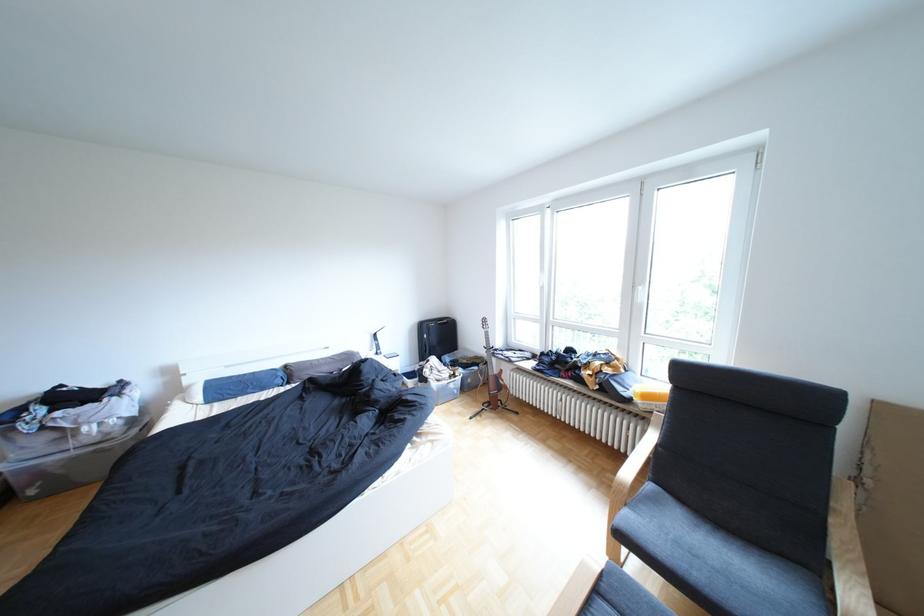
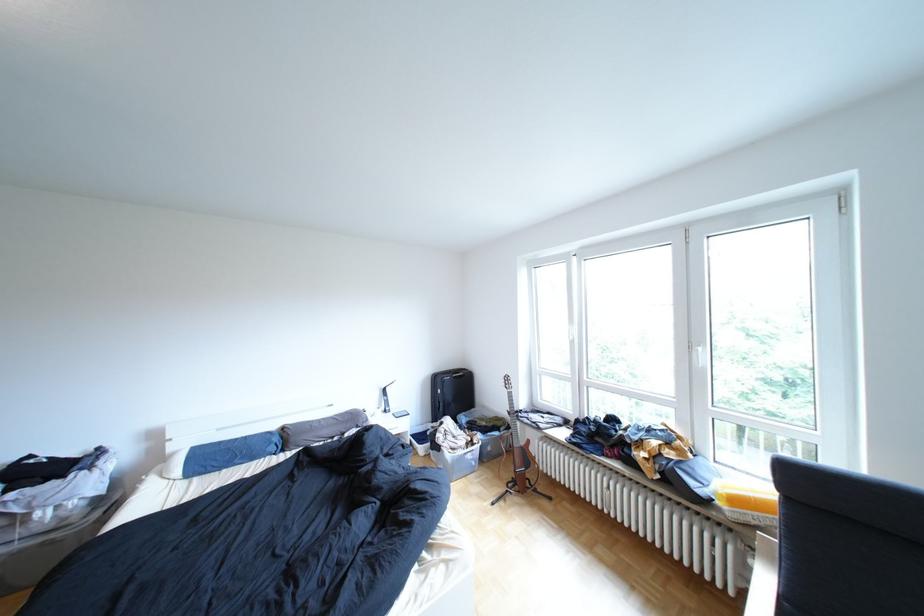
Where in the second image is the point corresponding to (456,378) from the first image?

(470, 446)